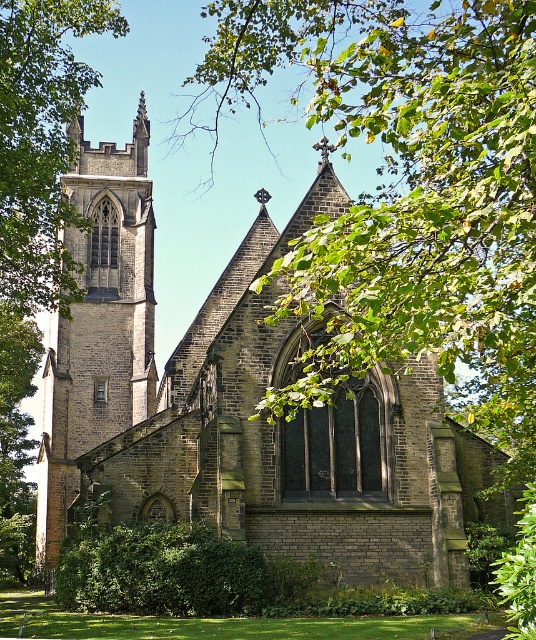
Question: From the image, what is the correct spatial relationship of brown stone tower at left in relation to green leafy tree at left?

Choices:
 (A) below
 (B) above

Answer: (A)

Question: Is brown stone church at center below green leafy tree at left?

Choices:
 (A) no
 (B) yes

Answer: (B)

Question: Based on their relative distances, which object is farther from the brown stone tower at left?

Choices:
 (A) brown stone church at center
 (B) green leafy tree at left

Answer: (B)

Question: Which point is closer to the camera?

Choices:
 (A) brown stone church at center
 (B) green leafy tree at left
 (C) brown stone tower at left

Answer: (A)

Question: Considering the relative positions of brown stone church at center and green leafy tree at left in the image provided, where is brown stone church at center located with respect to green leafy tree at left?

Choices:
 (A) below
 (B) above

Answer: (A)

Question: Estimate the real-world distances between objects in this image. Which object is farther from the brown stone church at center?

Choices:
 (A) brown stone tower at left
 (B) green leafy tree at left

Answer: (B)